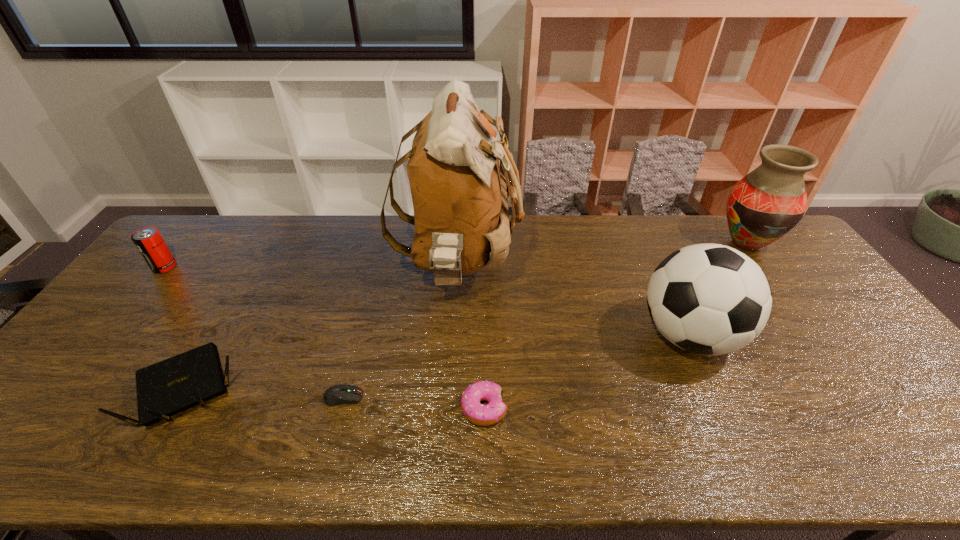
Image resolution: width=960 pixels, height=540 pixels. Identify the location of backpack. (459, 195).

What are the coordinates of `vase` in the screenshot? It's located at click(763, 206).

Locate an element on the screen. This screenshot has width=960, height=540. the fifth shortest object is located at coordinates (710, 299).

Identify the location of the sixth object from left to right. (x=710, y=299).

Image resolution: width=960 pixels, height=540 pixels. In order to click on the fourth shortest object in this screenshot , I will do coord(149,242).

At what (x,y) coordinates should I click in order to perform the action: click on can. Please return your answer as a coordinate pair (x, y). Looking at the image, I should click on (149, 242).

Where is `the fifth tallest object`? The height and width of the screenshot is (540, 960). the fifth tallest object is located at coordinates (166, 388).

You are a GUI agent. You are given a task and a screenshot of the screen. Output one action in this format:
    pyautogui.click(x=<x>, y=<y>)
    Task: Click on the router
    The image size is (960, 540).
    Given the screenshot: What is the action you would take?
    pyautogui.click(x=166, y=388)

At what (x,y) coordinates should I click in order to perform the action: click on doughnut. Please return your answer as a coordinate pair (x, y). The width and height of the screenshot is (960, 540). Looking at the image, I should click on click(482, 415).

You are a GUI agent. You are given a task and a screenshot of the screen. Output one action in this format:
    pyautogui.click(x=<x>, y=<y>)
    Task: Click on the third object from left to right
    The image size is (960, 540).
    Given the screenshot: What is the action you would take?
    pyautogui.click(x=339, y=394)